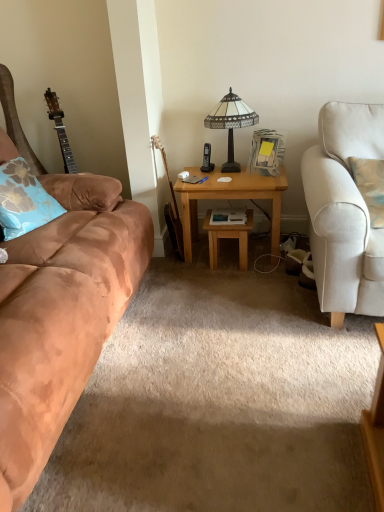
Image resolution: width=384 pixels, height=512 pixels. What do you see at coordinates (171, 207) in the screenshot?
I see `wooden acoustic guitar at center` at bounding box center [171, 207].

Image resolution: width=384 pixels, height=512 pixels. What are the coordinates of `suede brown couch at left` in the screenshot? It's located at (61, 315).

Describe the element at coordinates (231, 123) in the screenshot. This screenshot has height=512, width=384. I see `stained glass lamp at center` at that location.

Find the location of a particular element. The height and width of the screenshot is (512, 384). wooden desk at center is located at coordinates (230, 199).

At what (x,y) coordinates should I click in order to perform the action: click on wooden acoustic guitar at center. Please return your answer as a coordinate pair (x, y). The height and width of the screenshot is (512, 384). Looking at the image, I should click on (171, 207).

How distant is wooden table at center from wooden acoustic guitar at center?

wooden table at center is 12.30 inches away from wooden acoustic guitar at center.

Could you tell me if wooden table at center is facing wooden acoustic guitar at center?

No.

Is wooden table at center completely or partially outside of wooden acoustic guitar at center?

Yes.

Which is behind, point (251, 223) or point (152, 146)?

The point (251, 223) is farther from the camera.

Is wooden acoustic guitar at center far from blue floral pillow at left?

Actually, wooden acoustic guitar at center and blue floral pillow at left are a little close together.

Can we say wooden acoustic guitar at center lies outside blue floral pillow at left?

Yes, wooden acoustic guitar at center is not within blue floral pillow at left.

Which of these two, wooden acoustic guitar at center or blue floral pillow at left, stands taller?

Standing taller between the two is wooden acoustic guitar at center.

Locate an element on the screen. pillow above the wooden acoustic guitar at center (from a real-world perspective) is located at coordinates point(23,200).

Looking at their sizes, would you say blue floral pillow at left is wider or thinner than wooden acoustic guitar at center?

Considering their sizes, blue floral pillow at left looks broader than wooden acoustic guitar at center.

Is blue floral pillow at left facing away from wooden acoustic guitar at center?

No.

From a real-world perspective, is blue floral pillow at left on top of wooden acoustic guitar at center?

Yes, from a real-world perspective, blue floral pillow at left is over wooden acoustic guitar at center

In the image, is blue floral pillow at left positioned in front of or behind wooden acoustic guitar at center?

blue floral pillow at left is in front of wooden acoustic guitar at center.

From a real-world perspective, is suede brown couch at left on blue floral pillow at left?

Incorrect, from a real-world perspective, suede brown couch at left is lower than blue floral pillow at left.

Can blue floral pillow at left be found inside suede brown couch at left?

Absolutely, blue floral pillow at left is inside suede brown couch at left.

Measure the distance from suede brown couch at left to blue floral pillow at left.

They are 13.48 inches apart.

Identify the location of pillow that is in front of the wooden desk at center. (23, 200).

Which of these two, blue floral pillow at left or wooden desk at center, stands taller?

wooden desk at center.

Is there a large distance between blue floral pillow at left and wooden desk at center?

No.

From the image's perspective, is blue floral pillow at left over wooden desk at center?

Yes, from the image's perspective, blue floral pillow at left is on top of wooden desk at center.

Which is further, (213, 250) or (186, 185)?

Point (213, 250)

Between wooden table at center and wooden desk at center, which one is positioned in front?

wooden desk at center is in front.

From a real-world perspective, is wooden table at center positioned over wooden desk at center based on gravity?

No, from a real-world perspective, wooden table at center is not on top of wooden desk at center.

From the image's perspective, is wooden table at center located beneath wooden desk at center?

Yes, from the image's perspective, wooden table at center is below wooden desk at center.

Does wooden acoustic guitar at center have a smaller size compared to wooden desk at center?

Indeed, wooden acoustic guitar at center has a smaller size compared to wooden desk at center.

Would you say wooden acoustic guitar at center is inside or outside wooden desk at center?

wooden acoustic guitar at center lies outside wooden desk at center.

Is wooden acoustic guitar at center facing towards wooden desk at center?

Yes, wooden acoustic guitar at center is aimed at wooden desk at center.

In the image, is wooden acoustic guitar at center positioned in front of or behind wooden desk at center?

wooden acoustic guitar at center is positioned closer to the viewer than wooden desk at center.

This screenshot has height=512, width=384. What are the coordinates of `guitar positioned vertically above the wooden table at center (from a real-world perspective)` in the screenshot? It's located at (171, 207).

The height and width of the screenshot is (512, 384). Find the location of `pillow lying on the left of wooden acoustic guitar at center`. pillow lying on the left of wooden acoustic guitar at center is located at coordinates (23, 200).

Which object lies further to the anchor point blue floral pillow at left, wooden desk at center or wooden table at center?

wooden table at center is further to blue floral pillow at left.

Considering their positions, is wooden acoustic guitar at center positioned closer to stained glass lamp at center than suede brown couch at left?

wooden acoustic guitar at center.

When comparing their distances from wooden table at center, does blue floral pillow at left or wooden acoustic guitar at center seem further?

Among the two, blue floral pillow at left is located further to wooden table at center.

From the image, which object appears to be farther from blue floral pillow at left, suede brown couch at left or wooden desk at center?

The object further to blue floral pillow at left is wooden desk at center.

Looking at this image, estimate the real-world distances between objects in this image. Which object is further from suede brown couch at left, wooden acoustic guitar at center or blue floral pillow at left?

Among the two, wooden acoustic guitar at center is located further to suede brown couch at left.

Looking at the image, which one is located closer to suede brown couch at left, stained glass lamp at center or wooden acoustic guitar at center?

wooden acoustic guitar at center.

Estimate the real-world distances between objects in this image. Which object is further from suede brown couch at left, wooden table at center or wooden acoustic guitar at center?

wooden acoustic guitar at center.

Which object lies nearer to the anchor point wooden desk at center, wooden acoustic guitar at center or blue floral pillow at left?

wooden acoustic guitar at center.

Locate an element on the screen. lamp positioned between suede brown couch at left and wooden table at center from near to far is located at coordinates (231, 123).

The height and width of the screenshot is (512, 384). Find the location of `pillow located between suede brown couch at left and stained glass lamp at center in the depth direction`. pillow located between suede brown couch at left and stained glass lamp at center in the depth direction is located at coordinates (23, 200).

Image resolution: width=384 pixels, height=512 pixels. I want to click on guitar located between blue floral pillow at left and stained glass lamp at center in the left-right direction, so click(171, 207).

Image resolution: width=384 pixels, height=512 pixels. Identify the location of lamp between suede brown couch at left and wooden acoustic guitar at center from front to back. (231, 123).